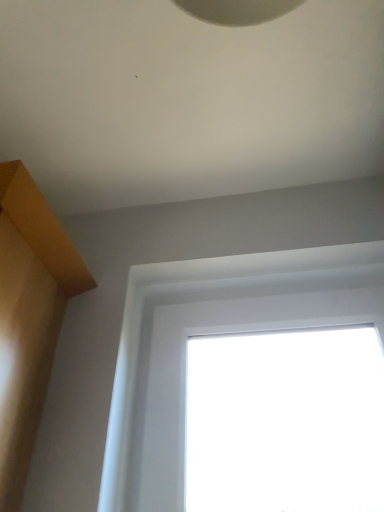
The width and height of the screenshot is (384, 512). What do you see at coordinates (30, 314) in the screenshot? I see `matte wood frame at left` at bounding box center [30, 314].

Identify the location of matte wood frame at left. Image resolution: width=384 pixels, height=512 pixels. (30, 314).

Locate an element on the screen. This screenshot has width=384, height=512. matte wood frame at left is located at coordinates (30, 314).